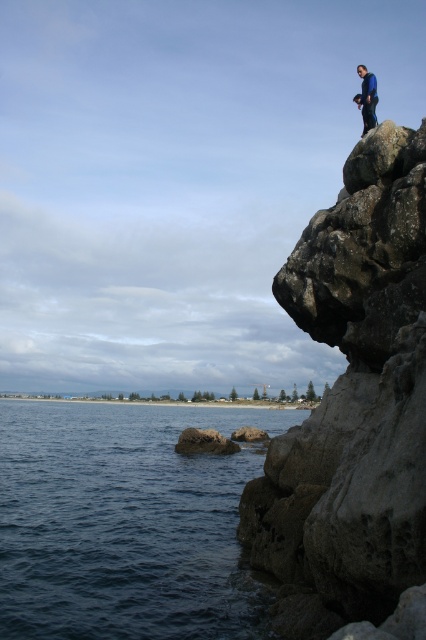
Which is below, rocky cliff at upper right or blue matte jacket at upper right?

Positioned lower is rocky cliff at upper right.

Does point (354, 371) lie behind point (356, 102)?

No, it is in front of (356, 102).

From the picture: Measure the distance between rocky cliff at upper right and camera.

A distance of 15.97 feet exists between rocky cliff at upper right and camera.

Where is `rocky cliff at upper right`? The width and height of the screenshot is (426, 640). rocky cliff at upper right is located at coordinates (354, 404).

Which of these two, dark blue water at lower left or rough textured rock at lower center, stands taller?

dark blue water at lower left

The image size is (426, 640). I want to click on dark blue water at lower left, so click(126, 522).

Does rocky cliff at upper right have a smaller size compared to rough textured rock at lower center?

Incorrect, rocky cliff at upper right is not smaller in size than rough textured rock at lower center.

Based on the photo, does rocky cliff at upper right have a lesser width compared to rough textured rock at lower center?

Incorrect, rocky cliff at upper right's width is not less than rough textured rock at lower center's.

Identify the location of rocky cliff at upper right. The height and width of the screenshot is (640, 426). (354, 404).